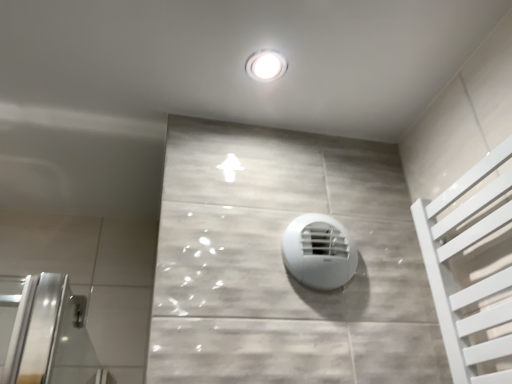
The width and height of the screenshot is (512, 384). What do you see at coordinates (266, 65) in the screenshot? I see `white glossy light fixture at upper center` at bounding box center [266, 65].

I want to click on white glossy light fixture at upper center, so (x=266, y=65).

The width and height of the screenshot is (512, 384). Find the location of `white glossy light fixture at upper center`. white glossy light fixture at upper center is located at coordinates pyautogui.click(x=266, y=65).